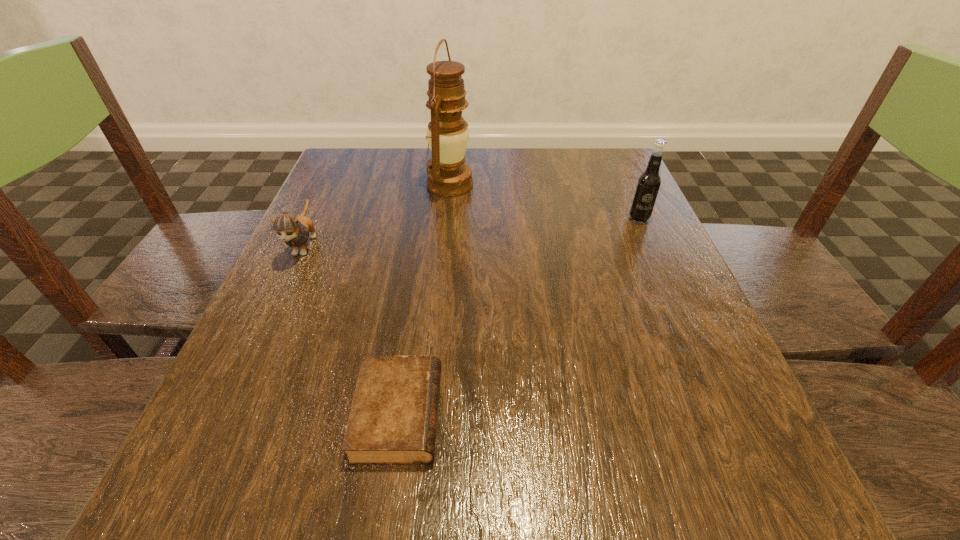
Find the location of a particular element. The width and height of the screenshot is (960, 540). vacant space at the near left corner is located at coordinates (257, 514).

Find the location of a particular element. vacant space at the far right corner of the desktop is located at coordinates (601, 186).

This screenshot has width=960, height=540. What are the coordinates of `vacant space that is in between the oil lamp and the rightmost object` in the screenshot? It's located at (544, 201).

Locate an element on the screen. This screenshot has width=960, height=540. free space between the nearest object and the third shortest object is located at coordinates (518, 316).

Where is `vacant area that lies between the shortest object and the second shortest object`? vacant area that lies between the shortest object and the second shortest object is located at coordinates (351, 329).

At what (x,y) coordinates should I click in order to perform the action: click on free space between the leftmost object and the second tallest object. Please return your answer as a coordinate pair (x, y). This screenshot has height=540, width=960. Looking at the image, I should click on (471, 232).

Locate an element on the screen. The image size is (960, 540). empty space that is in between the leftmost object and the nearest object is located at coordinates (351, 329).

Identify the location of vacant space that is in between the tallest object and the kitten. (377, 214).

This screenshot has width=960, height=540. Identify the location of free space between the farthest object and the kitten. (377, 214).

Locate an element on the screen. blank region between the shortest object and the rightmost object is located at coordinates (518, 316).